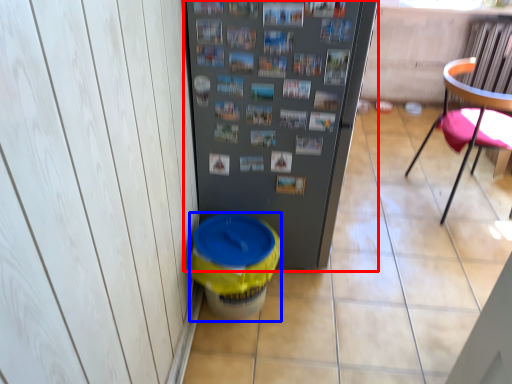
Question: Among these objects, which one is farthest to the camera, refrigerator (highlighted by a red box) or potty (highlighted by a blue box)?

Choices:
 (A) refrigerator
 (B) potty

Answer: (B)